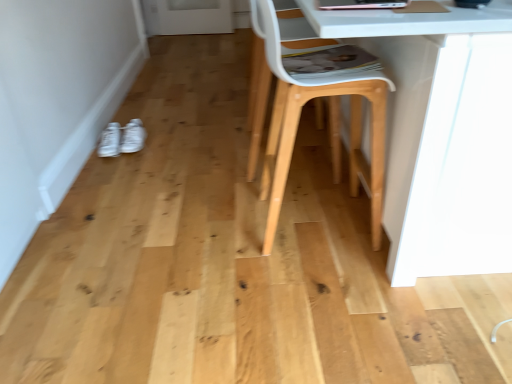
Question: Is natural wood chair at center taller than white matte sneakers at lower left, the 1th footwear from the right?

Choices:
 (A) yes
 (B) no

Answer: (A)

Question: From the image's perspective, does natural wood chair at center appear lower than white matte sneakers at lower left, positioned as the second footwear in left-to-right order?

Choices:
 (A) no
 (B) yes

Answer: (B)

Question: From the image's perspective, is natural wood chair at center over white matte sneakers at lower left, positioned as the second footwear in left-to-right order?

Choices:
 (A) yes
 (B) no

Answer: (B)

Question: Is natural wood chair at center oriented towards white matte sneakers at lower left, the 1th footwear from the right?

Choices:
 (A) no
 (B) yes

Answer: (A)

Question: From a real-world perspective, is natural wood chair at center positioned under white matte sneakers at lower left, positioned as the second footwear in left-to-right order, based on gravity?

Choices:
 (A) yes
 (B) no

Answer: (B)

Question: In terms of height, does white matte sneakers at lower left, positioned as the second footwear in left-to-right order, look taller or shorter compared to white plastic swivel chair at center?

Choices:
 (A) tall
 (B) short

Answer: (B)

Question: Is point (132, 127) closer or farther from the camera than point (288, 16)?

Choices:
 (A) farther
 (B) closer

Answer: (A)

Question: Looking at their shapes, would you say white matte sneakers at lower left, positioned as the second footwear in left-to-right order, is wider or thinner than white plastic swivel chair at center?

Choices:
 (A) wide
 (B) thin

Answer: (B)

Question: Choose the correct answer: Is white matte sneakers at lower left, the 1th footwear from the right, inside white plastic swivel chair at center or outside it?

Choices:
 (A) outside
 (B) inside

Answer: (A)

Question: In terms of height, does natural wood chair at center look taller or shorter compared to white fabric sneakers at lower left, which appears as the second footwear when viewed from the right?

Choices:
 (A) tall
 (B) short

Answer: (A)

Question: In terms of width, does natural wood chair at center look wider or thinner when compared to white fabric sneakers at lower left, which appears as the second footwear when viewed from the right?

Choices:
 (A) wide
 (B) thin

Answer: (A)

Question: From a real-world perspective, is natural wood chair at center physically located above or below white fabric sneakers at lower left, which appears as the second footwear when viewed from the right?

Choices:
 (A) above
 (B) below

Answer: (A)

Question: Considering the positions of point (358, 92) and point (99, 153), is point (358, 92) closer or farther from the camera than point (99, 153)?

Choices:
 (A) closer
 (B) farther

Answer: (A)

Question: From a real-world perspective, is white fabric sneakers at lower left, which appears as the second footwear when viewed from the right, physically located above or below white matte sneakers at lower left, the 1th footwear from the right?

Choices:
 (A) above
 (B) below

Answer: (B)

Question: Is white fabric sneakers at lower left, arranged as the 1th footwear when viewed from the left, inside the boundaries of white matte sneakers at lower left, the 1th footwear from the right, or outside?

Choices:
 (A) outside
 (B) inside

Answer: (A)